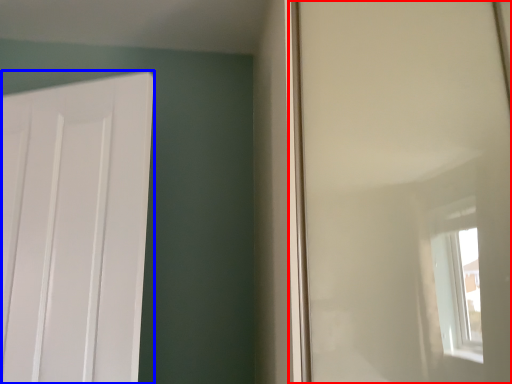
Question: Among these objects, which one is nearest to the camera, window screen (highlighted by a red box) or door (highlighted by a blue box)?

Choices:
 (A) window screen
 (B) door

Answer: (A)